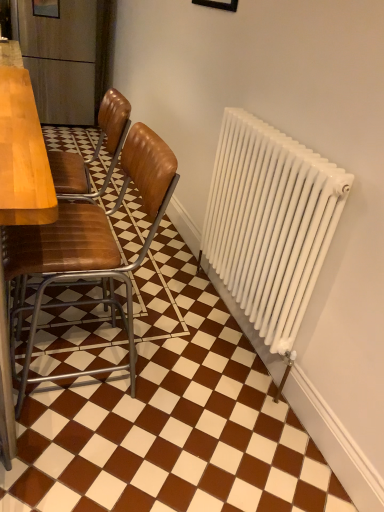
Locate an element on the screen. This screenshot has height=512, width=384. empty space that is to the right of brown leather chair at left is located at coordinates (193, 388).